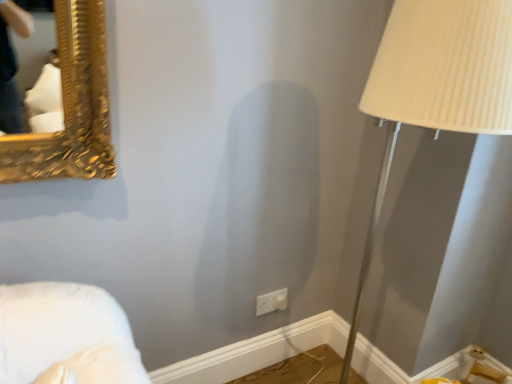
Question: From the image's perspective, is beige ribbed shade at right located above or below white plastic electric outlet at lower center?

Choices:
 (A) below
 (B) above

Answer: (B)

Question: Based on their positions, is beige ribbed shade at right located to the left or right of white plastic electric outlet at lower center?

Choices:
 (A) right
 (B) left

Answer: (A)

Question: Relative to white plastic electric outlet at lower center, is beige ribbed shade at right in front or behind?

Choices:
 (A) behind
 (B) front

Answer: (B)

Question: Considering their positions, is white plastic electric outlet at lower center located in front of or behind beige ribbed shade at right?

Choices:
 (A) front
 (B) behind

Answer: (B)

Question: From a real-world perspective, is white plastic electric outlet at lower center above or below beige ribbed shade at right?

Choices:
 (A) below
 (B) above

Answer: (A)

Question: From the image's perspective, is white plastic electric outlet at lower center located above or below beige ribbed shade at right?

Choices:
 (A) below
 (B) above

Answer: (A)

Question: Looking at their shapes, would you say white plastic electric outlet at lower center is wider or thinner than beige ribbed shade at right?

Choices:
 (A) thin
 (B) wide

Answer: (A)